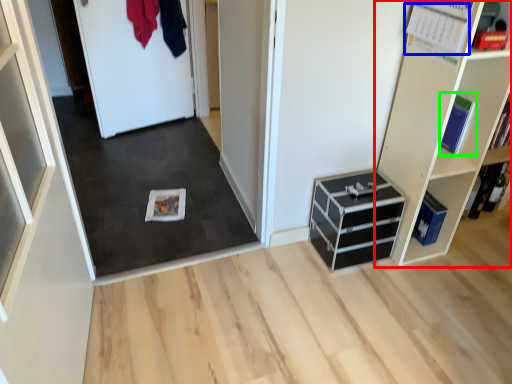
Question: Based on their relative distances, which object is nearer to shelf (highlighted by a red box)? Choose from book (highlighted by a blue box) and book (highlighted by a green box).

Choices:
 (A) book
 (B) book

Answer: (B)